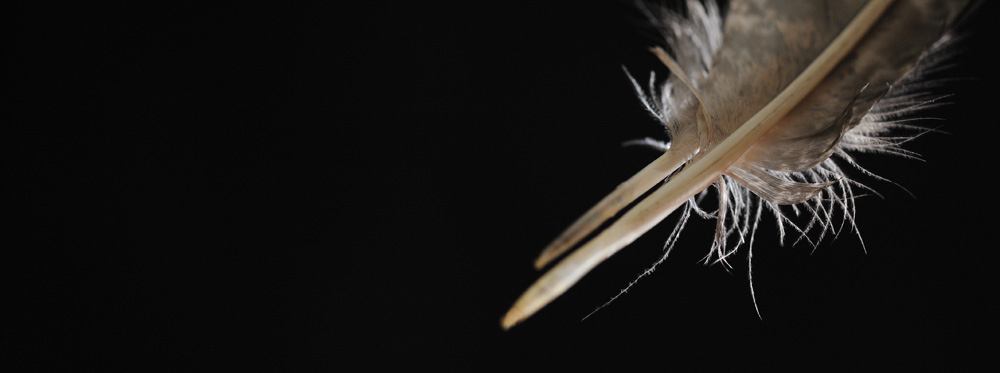
This screenshot has width=1000, height=373. I want to click on white light behind feather, so click(x=862, y=144).